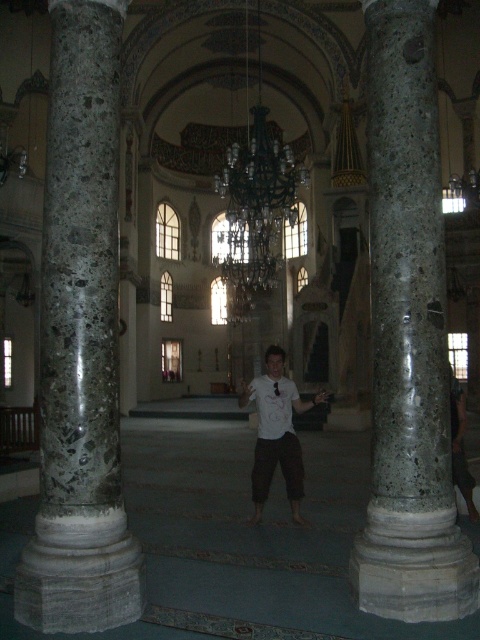
Does white matte shirt at center have a smaller size compared to dark brown leather pants at right?

No, white matte shirt at center is not smaller than dark brown leather pants at right.

Can you confirm if white matte shirt at center is positioned above dark brown leather pants at right?

No.

Between point (296, 490) and point (451, 416), which one is positioned behind?

The point (296, 490) is more distant.

The image size is (480, 640). Identify the location of white matte shirt at center. (276, 433).

In the scene shown: Is marble column at center positioned in front of white matte shirt at center?

Yes, it is.

Looking at this image, measure the distance between marble column at center and white matte shirt at center.

They are 7.47 meters apart.

Where is `marble column at center`? Image resolution: width=480 pixels, height=640 pixels. marble column at center is located at coordinates (408, 339).

Between marble column at left and marble column at center, which one appears on the left side from the viewer's perspective?

marble column at left

Between marble column at left and marble column at center, which one appears on the right side from the viewer's perspective?

Positioned to the right is marble column at center.

What do you see at coordinates (81, 342) in the screenshot? I see `marble column at left` at bounding box center [81, 342].

Where is `marble column at left`? This screenshot has height=640, width=480. marble column at left is located at coordinates (81, 342).